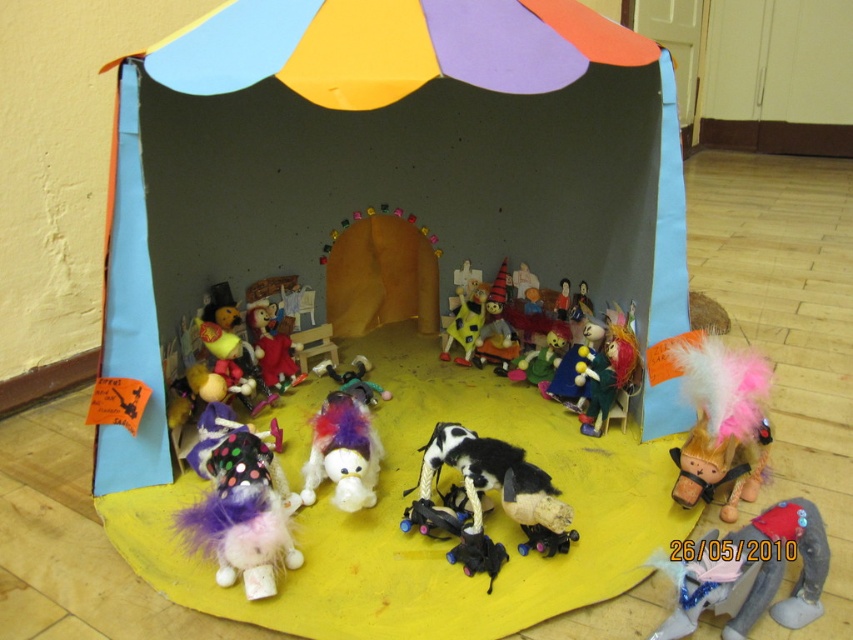
Question: Can you confirm if fuzzy purple and white stuffed animal at lower left is bigger than fuzzy black and white dog at center?

Choices:
 (A) yes
 (B) no

Answer: (A)

Question: Is multicolored fabric doll at center above fuzzy black and white dog at center?

Choices:
 (A) yes
 (B) no

Answer: (A)

Question: Which object is the closest to the fuzzy purple and white stuffed animal at lower left?

Choices:
 (A) cardboard tent at center
 (B) multicolored fabric doll at center
 (C) feathered brown horse at right

Answer: (A)

Question: Is fuzzy white dog at center wider than yellow fabric doll at center?

Choices:
 (A) no
 (B) yes

Answer: (B)

Question: Which object is farther from the camera taking this photo?

Choices:
 (A) yellow fabric doll at center
 (B) feathered brown horse at right
 (C) multicolored fabric doll at center
 (D) fuzzy black and white dog at center

Answer: (A)

Question: Which point is closer to the camera taking this photo?

Choices:
 (A) (785, 605)
 (B) (469, 326)

Answer: (A)